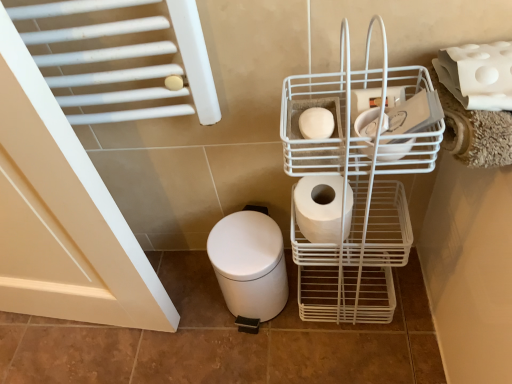
Question: From the image's perspective, would you say white matte toilet paper at center, the first toilet paper in the left-to-right sequence, is positioned over white matte toilet paper at upper right, the 4th toilet paper in the left-to-right sequence?

Choices:
 (A) no
 (B) yes

Answer: (A)

Question: Considering the relative positions of white matte toilet paper at center, positioned as the fourth toilet paper in right-to-left order, and white matte toilet paper at upper right, which is counted as the 1th toilet paper, starting from the right, in the image provided, is white matte toilet paper at center, positioned as the fourth toilet paper in right-to-left order, to the left of white matte toilet paper at upper right, which is counted as the 1th toilet paper, starting from the right, from the viewer's perspective?

Choices:
 (A) no
 (B) yes

Answer: (B)

Question: Does white matte toilet paper at center, the first toilet paper in the left-to-right sequence, have a greater height compared to white matte toilet paper at upper right, which is counted as the 1th toilet paper, starting from the right?

Choices:
 (A) yes
 (B) no

Answer: (B)

Question: Does white matte toilet paper at center, positioned as the fourth toilet paper in right-to-left order, have a lesser width compared to white matte toilet paper at upper right, which is counted as the 1th toilet paper, starting from the right?

Choices:
 (A) yes
 (B) no

Answer: (A)

Question: From the image's perspective, is white matte toilet paper at center, positioned as the fourth toilet paper in right-to-left order, under white matte toilet paper at upper right, the 4th toilet paper in the left-to-right sequence?

Choices:
 (A) yes
 (B) no

Answer: (A)

Question: Is white matte toilet paper at center, positioned as the fourth toilet paper in right-to-left order, placed right next to white matte toilet paper at upper right, the 4th toilet paper in the left-to-right sequence?

Choices:
 (A) yes
 (B) no

Answer: (B)

Question: Is white matte toilet paper at upper right, which is counted as the 1th toilet paper, starting from the right, not inside white matte toilet paper at center-right, the second toilet paper when ordered from left to right?

Choices:
 (A) no
 (B) yes

Answer: (B)

Question: Would you say white matte toilet paper at upper right, the 4th toilet paper in the left-to-right sequence, is a long distance from white matte toilet paper at center-right, marked as the third toilet paper in a right-to-left arrangement?

Choices:
 (A) no
 (B) yes

Answer: (A)

Question: From a real-world perspective, is white matte toilet paper at upper right, which is counted as the 1th toilet paper, starting from the right, physically below white matte toilet paper at center-right, marked as the third toilet paper in a right-to-left arrangement?

Choices:
 (A) no
 (B) yes

Answer: (A)

Question: Is white matte toilet paper at upper right, which is counted as the 1th toilet paper, starting from the right, to the left of white matte toilet paper at center-right, the second toilet paper when ordered from left to right, from the viewer's perspective?

Choices:
 (A) yes
 (B) no

Answer: (B)

Question: Is white matte toilet paper at upper right, which is counted as the 1th toilet paper, starting from the right, further to camera compared to white matte toilet paper at center-right, the second toilet paper when ordered from left to right?

Choices:
 (A) no
 (B) yes

Answer: (A)

Question: Can you confirm if white matte toilet paper at upper right, which is counted as the 1th toilet paper, starting from the right, is wider than white matte toilet paper at center-right, marked as the third toilet paper in a right-to-left arrangement?

Choices:
 (A) no
 (B) yes

Answer: (B)

Question: Is white matte toilet bowl at lower left bigger than white matte toilet paper at upper right, the 4th toilet paper in the left-to-right sequence?

Choices:
 (A) yes
 (B) no

Answer: (A)